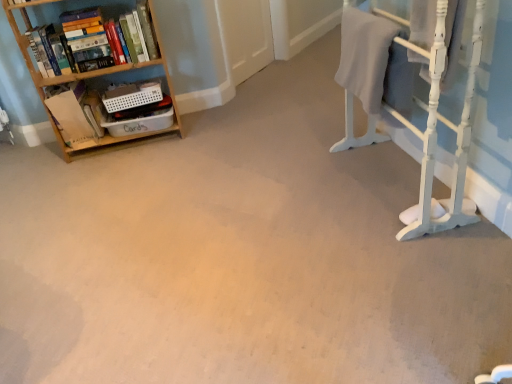
You are a GUI agent. You are given a task and a screenshot of the screen. Output one action in this format:
    pyautogui.click(x=<x>, y=<y>)
    Task: Click on the free space above gray cotton bath towel at upper right (from a real-world perspective)
    The image size is (512, 384).
    Given the screenshot: What is the action you would take?
    pyautogui.click(x=366, y=20)